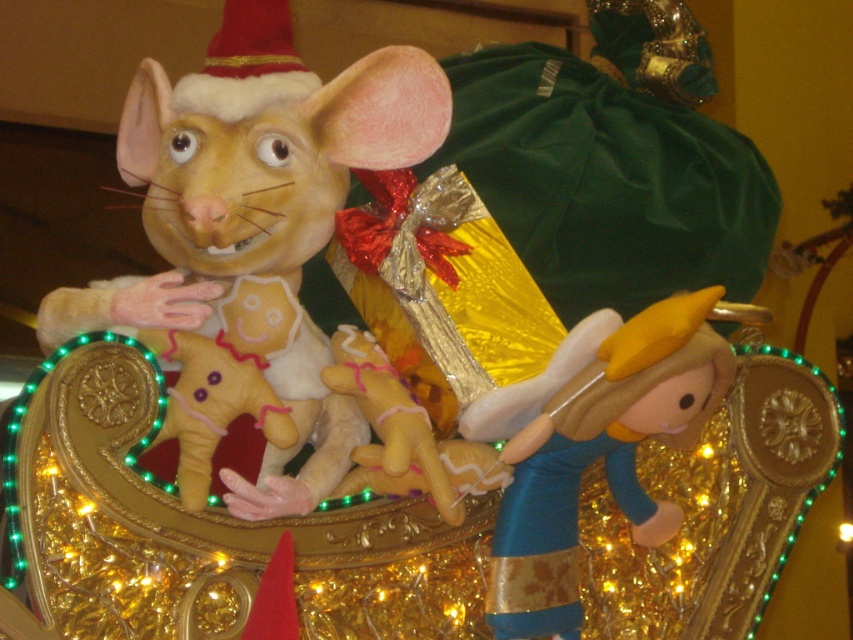
Is point (695, 308) less distant than point (200, 484)?

No, it is behind (200, 484).

Can you confirm if velvet blue plush at right is positioned below soft plush gingerbread man at center?

Indeed, velvet blue plush at right is positioned under soft plush gingerbread man at center.

Find the location of a particular element. The width and height of the screenshot is (853, 640). velvet blue plush at right is located at coordinates (601, 456).

Image resolution: width=853 pixels, height=640 pixels. Find the location of `velvet blue plush at right`. velvet blue plush at right is located at coordinates (601, 456).

Does matte yellow plush mouse at center have a smaller size compared to velvet blue plush at right?

No.

Which of these two, matte yellow plush mouse at center or velvet blue plush at right, stands taller?

With more height is matte yellow plush mouse at center.

Where is `matte yellow plush mouse at center`? This screenshot has width=853, height=640. matte yellow plush mouse at center is located at coordinates (257, 212).

Who is more distant from viewer, (430, 92) or (292, 435)?

Point (430, 92)

Measure the distance between point (209, 204) and camera.

The distance of point (209, 204) from camera is 58.57 meters.

The height and width of the screenshot is (640, 853). Find the location of `matte yellow plush mouse at center`. matte yellow plush mouse at center is located at coordinates (257, 212).

Locate an element on the screen. This screenshot has width=853, height=640. matte yellow plush mouse at center is located at coordinates (257, 212).